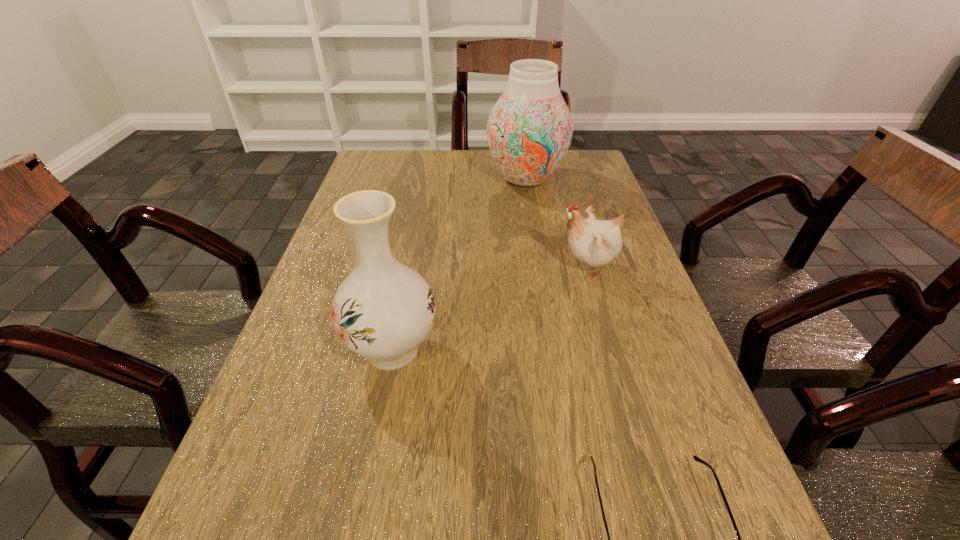
Where is `free space located at the beak of the second shortest object`? The width and height of the screenshot is (960, 540). free space located at the beak of the second shortest object is located at coordinates (472, 267).

The image size is (960, 540). I want to click on object that is positioned at the far edge, so click(529, 130).

Identify the location of object positioned at the left edge. (383, 310).

Where is `vase that is positioned at the right edge`? vase that is positioned at the right edge is located at coordinates pos(529,130).

Where is `bird positioned at the right edge`? Image resolution: width=960 pixels, height=540 pixels. bird positioned at the right edge is located at coordinates (595, 242).

The image size is (960, 540). What are the coordinates of `object positioned at the far right corner` in the screenshot? It's located at (529, 130).

Where is `free location at the left edge`? free location at the left edge is located at coordinates (301, 431).

The height and width of the screenshot is (540, 960). Find the location of `blank space at the right edge of the desktop`. blank space at the right edge of the desktop is located at coordinates [588, 308].

Where is `vacant space at the far left corner`? vacant space at the far left corner is located at coordinates (400, 154).

This screenshot has width=960, height=540. Identify the location of free space between the third farthest object and the bird. (490, 308).